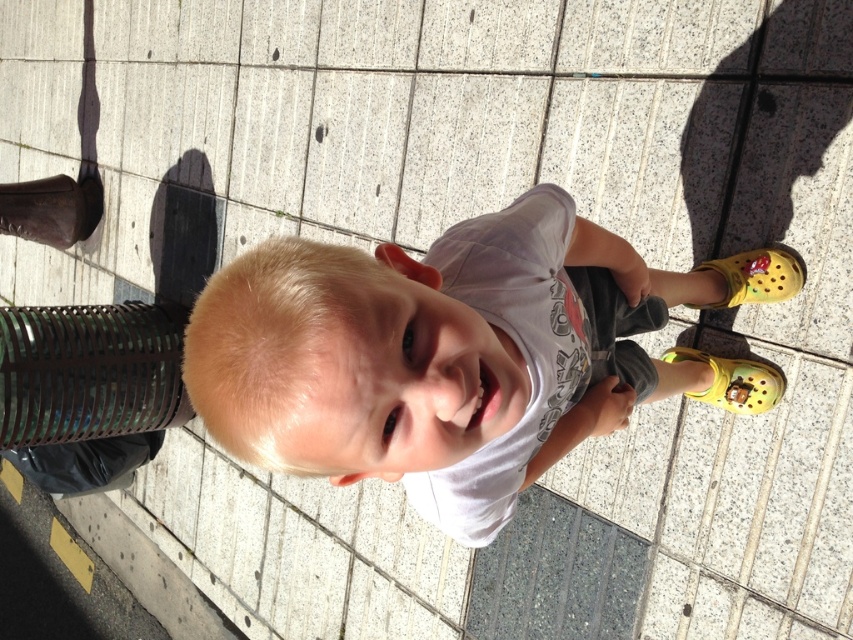
Is white cotton shirt at center smaller than brown leather boot at left?

Actually, white cotton shirt at center might be larger than brown leather boot at left.

Does white cotton shirt at center appear on the left side of brown leather boot at left?

Incorrect, white cotton shirt at center is not on the left side of brown leather boot at left.

You are a GUI agent. You are given a task and a screenshot of the screen. Output one action in this format:
    pyautogui.click(x=<x>, y=<y>)
    Task: Click on the white cotton shirt at center
    Image resolution: width=853 pixels, height=640 pixels.
    Given the screenshot: What is the action you would take?
    [x=437, y=355]

Locate an element on the screen. The image size is (853, 640). white cotton shirt at center is located at coordinates (437, 355).

Between white cotton shirt at center and yellow croc shoe at lower right, which one is positioned higher?

white cotton shirt at center

From the picture: Does white cotton shirt at center appear on the right side of yellow croc shoe at lower right?

No, white cotton shirt at center is not to the right of yellow croc shoe at lower right.

Measure the distance between white cotton shirt at center and camera.

The distance of white cotton shirt at center from camera is 33.60 inches.

Identify the location of white cotton shirt at center. (437, 355).

Can you confirm if yellow croc shoe at lower right is positioned above yellow croc at lower right?

No, yellow croc shoe at lower right is not above yellow croc at lower right.

Is point (755, 369) positioned after point (780, 273)?

Yes, point (755, 369) is behind point (780, 273).

This screenshot has width=853, height=640. I want to click on yellow croc shoe at lower right, so click(x=733, y=381).

Image resolution: width=853 pixels, height=640 pixels. What are the coordinates of `yellow croc shoe at lower right` in the screenshot? It's located at (733, 381).